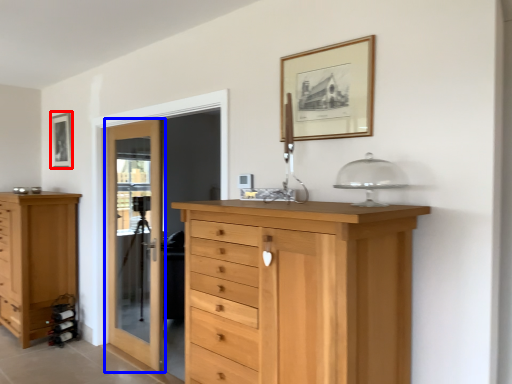
Question: Among these objects, which one is nearest to the camera, picture frame (highlighted by a red box) or door (highlighted by a blue box)?

Choices:
 (A) picture frame
 (B) door

Answer: (B)